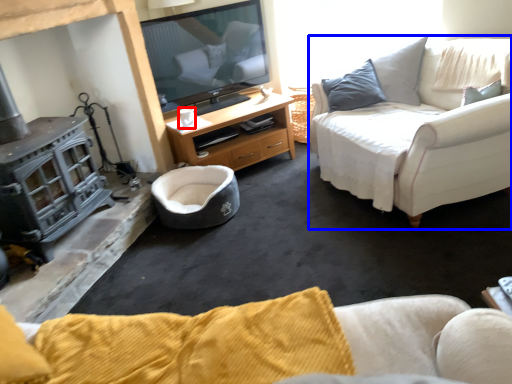
Question: Among these objects, which one is farthest to the camera, coffee cup (highlighted by a red box) or studio couch (highlighted by a blue box)?

Choices:
 (A) coffee cup
 (B) studio couch

Answer: (A)